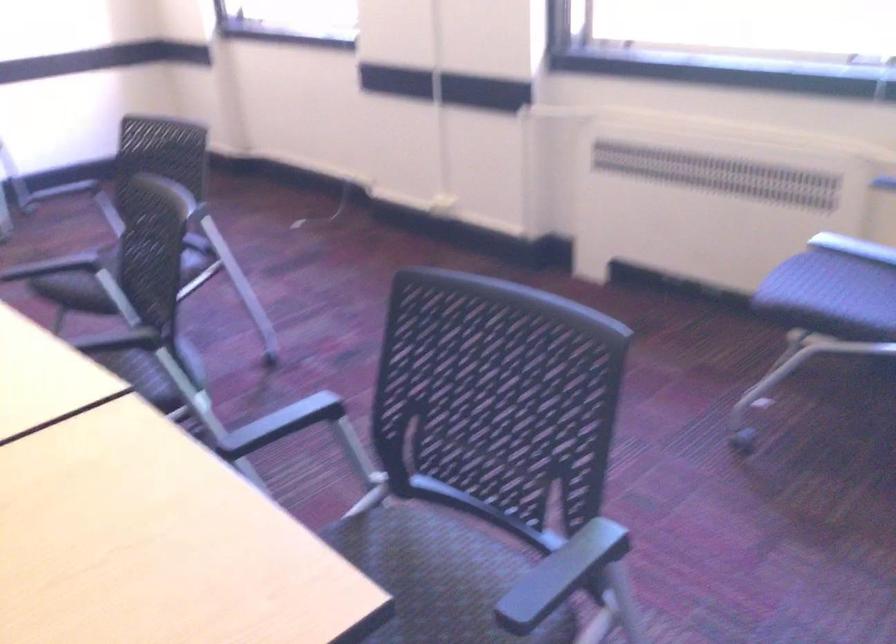
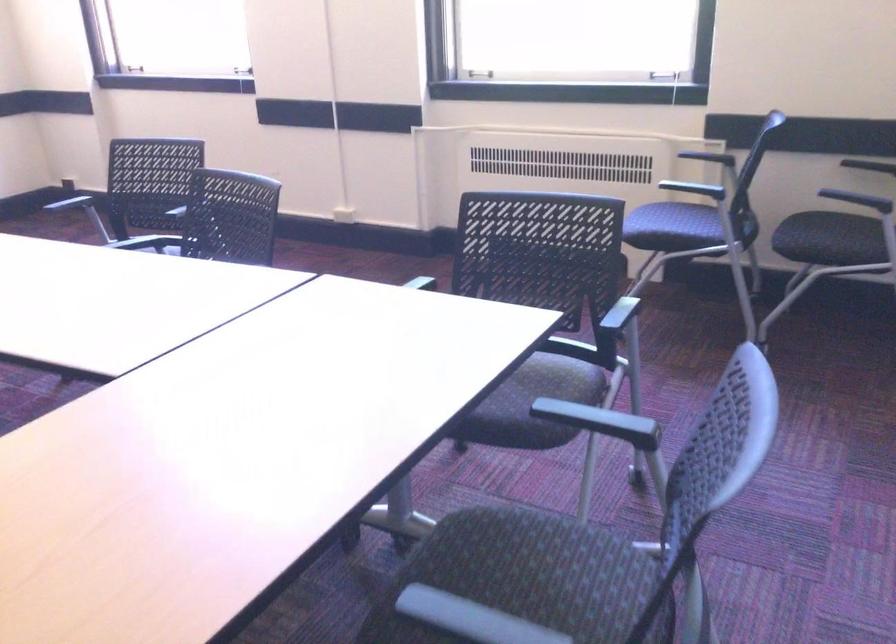
Locate, in the second image, the point that corresponds to (780,400) in the first image.

(641, 308)